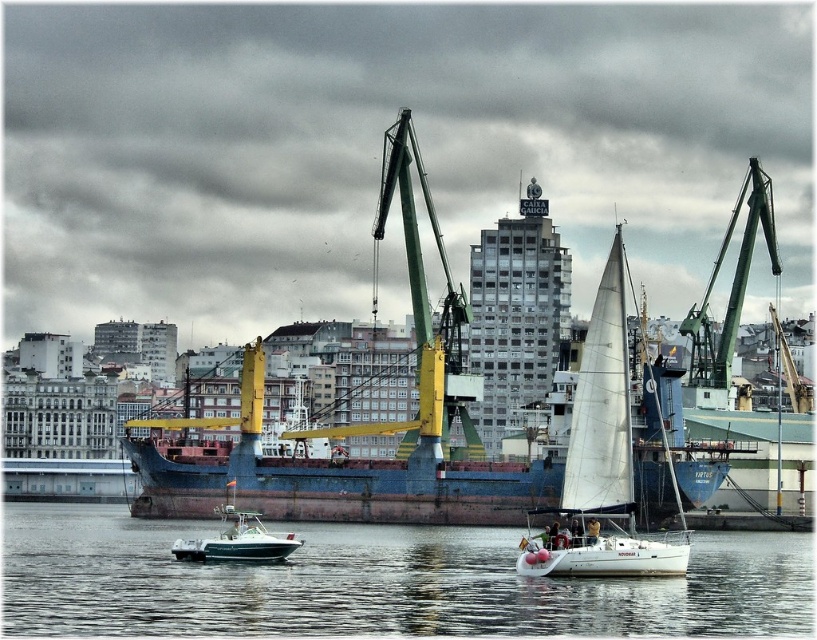
You are a harbor inspector checking the harbor layout. You see the clear water at lower center and the green plastic motorboat at lower center. Which object is wider?

The clear water at lower center is wider than the green plastic motorboat at lower center according to the description.

You are standing at the point with coordinates point (601, 461). Which object are you standing on?

You are standing on the white sailboat at center.